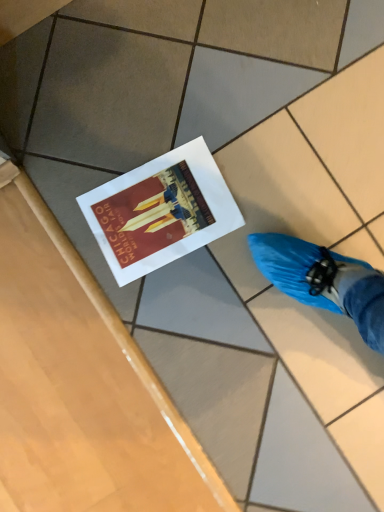
At what (x,y) coordinates should I click in order to perform the action: click on matte paper postcard at center. Please return your answer as a coordinate pair (x, y). Image resolution: width=384 pixels, height=512 pixels. Looking at the image, I should click on (160, 211).

Measure the distance between matte paper postcard at center and camera.

A distance of 34.87 inches exists between matte paper postcard at center and camera.

Describe the element at coordinates (160, 211) in the screenshot. The width and height of the screenshot is (384, 512). I see `matte paper postcard at center` at that location.

Find the location of a particular element. The height and width of the screenshot is (512, 384). matte paper postcard at center is located at coordinates (160, 211).